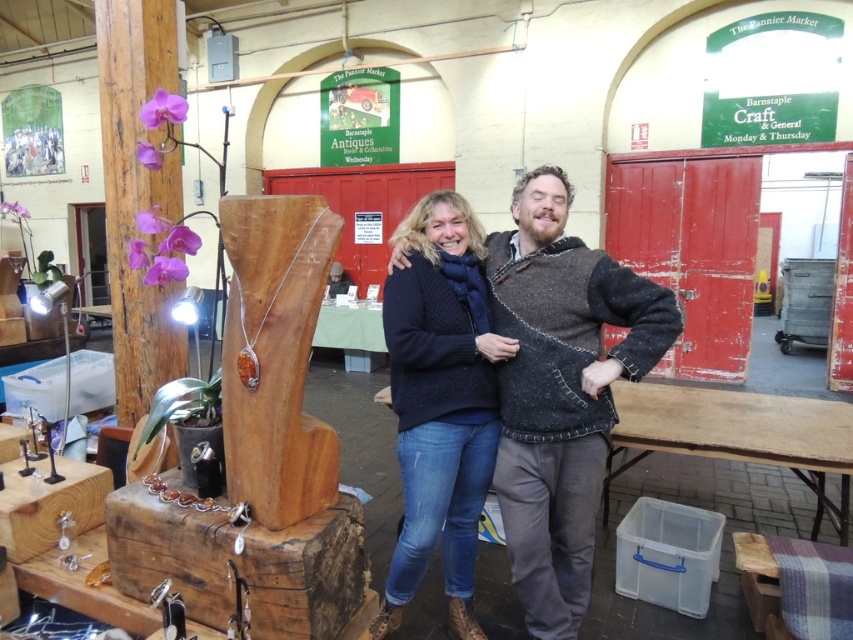
Does wooden sculpture at left appear on the left side of wooden post at left?

Incorrect, wooden sculpture at left is not on the left side of wooden post at left.

How much distance is there between wooden sculpture at left and wooden post at left?

wooden sculpture at left and wooden post at left are 3.86 feet apart from each other.

Does point (282, 592) come farther from viewer compared to point (142, 134)?

That is False.

Find the location of `wooden sculpture at left`. wooden sculpture at left is located at coordinates (260, 451).

Does wooden sculpture at left appear on the left side of knitted sweater at center?

Correct, you'll find wooden sculpture at left to the left of knitted sweater at center.

Does wooden sculpture at left have a greater width compared to knitted sweater at center?

Yes, wooden sculpture at left is wider than knitted sweater at center.

Does point (305, 240) come closer to viewer compared to point (543, 612)?

Yes, point (305, 240) is in front of point (543, 612).

Where is `wooden sculpture at left`? This screenshot has width=853, height=640. wooden sculpture at left is located at coordinates (260, 451).

Between knitted sweater at center and knitted dark blue sweater at center, which one has more height?

With more height is knitted dark blue sweater at center.

Which is below, knitted sweater at center or knitted dark blue sweater at center?

Positioned lower is knitted dark blue sweater at center.

Between point (494, 308) and point (428, 262), which one is positioned in front?

Point (494, 308) is in front.

You are a GUI agent. You are given a task and a screenshot of the screen. Output one action in this format:
    pyautogui.click(x=<x>, y=<y>)
    Task: Click on the knitted sweater at center
    The height and width of the screenshot is (640, 853).
    Given the screenshot: What is the action you would take?
    pyautogui.click(x=561, y=392)